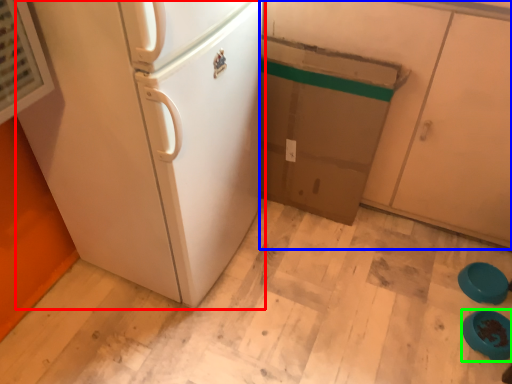
Question: Which is nearer to the refrigerator (highlighted by a red box)? cabinetry (highlighted by a blue box) or appliance (highlighted by a green box).

Choices:
 (A) cabinetry
 (B) appliance

Answer: (A)